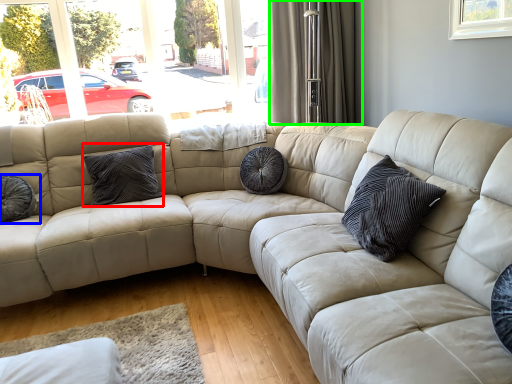
Question: Estimate the real-world distances between objects in this image. Which object is closer to pillow (highlighted by a red box), pillow (highlighted by a blue box) or curtain (highlighted by a green box)?

Choices:
 (A) pillow
 (B) curtain

Answer: (A)